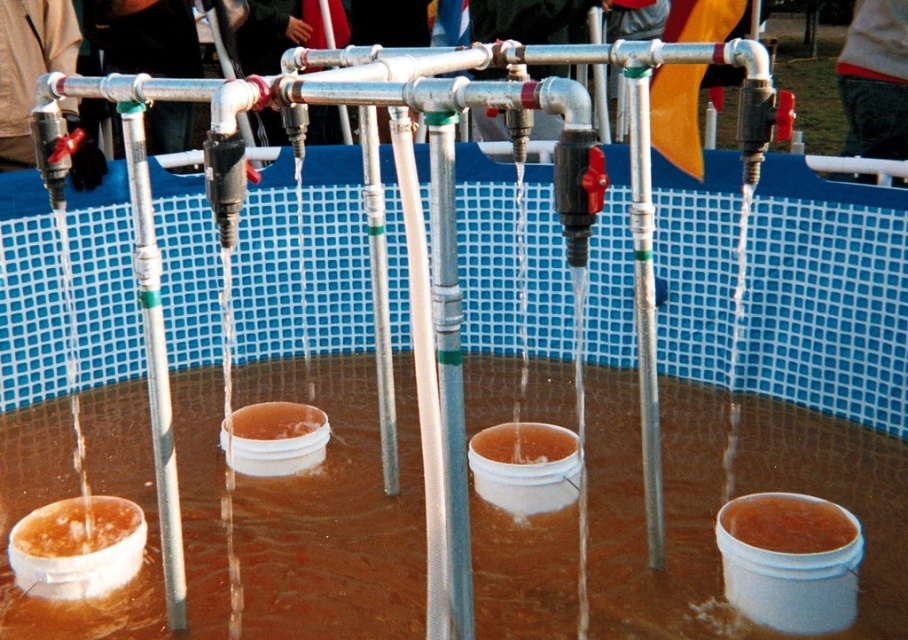
Between point (133, 502) and point (252, 404), which one is positioned in front?

Point (133, 502) is in front.

Is point (131, 513) more distant than point (254, 428)?

No, it is not.

At what (x,y) coordinates should I click in order to perform the action: click on translucent amber liquid at lower left. Please return your answer as a coordinate pair (x, y). Looking at the image, I should click on (76, 525).

The width and height of the screenshot is (908, 640). In order to click on translucent amber liquid at lower left in this screenshot , I will do `click(76, 525)`.

Does translucent orange liquid at center appear on the right side of brown matte bucket at center?

Indeed, translucent orange liquid at center is positioned on the right side of brown matte bucket at center.

What are the coordinates of `translucent orange liquid at center` in the screenshot? It's located at (522, 444).

Is point (490, 433) closer to camera compared to point (306, 406)?

Yes, it is in front of point (306, 406).

Locate an element on the screen. The width and height of the screenshot is (908, 640). translucent orange liquid at center is located at coordinates (522, 444).

Does point (818, 547) lie behind point (568, 445)?

No, (818, 547) is closer to viewer.

Consider the image. Who is higher up, brown matte bucket at lower right or translucent orange liquid at center?

Positioned higher is translucent orange liquid at center.

This screenshot has width=908, height=640. What are the coordinates of `brown matte bucket at lower right` in the screenshot? It's located at (787, 524).